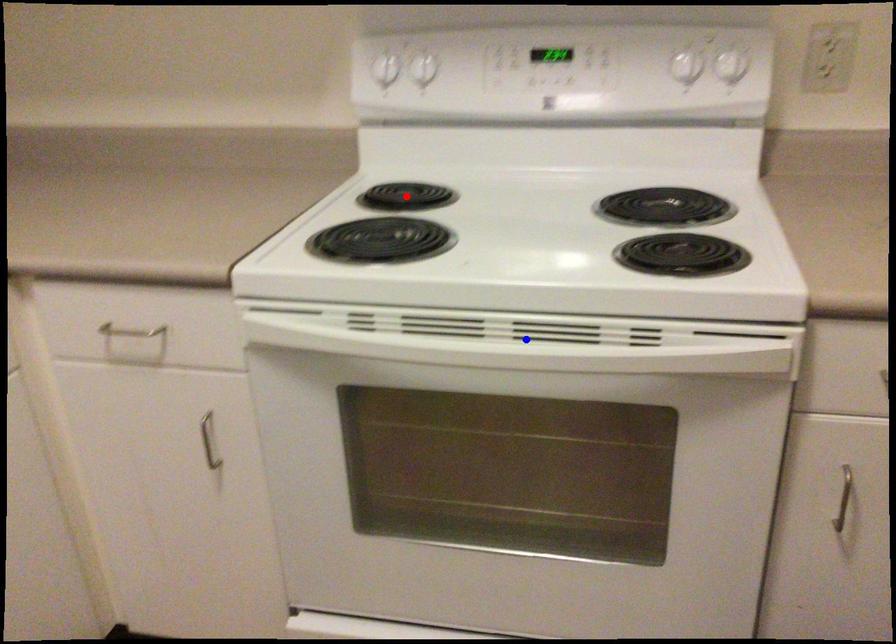
Question: Which of the two points in the image is closer to the camera?

Choices:
 (A) Blue point is closer.
 (B) Red point is closer.

Answer: (A)